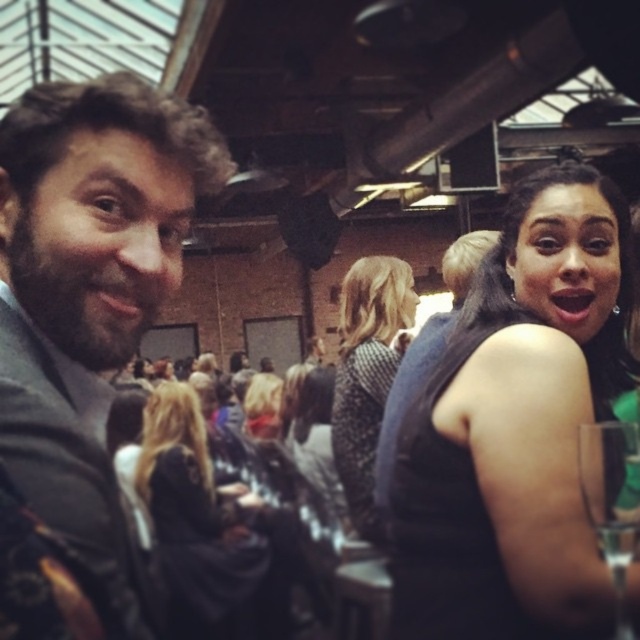
Question: Which of these objects is positioned closest to the dark gray suit at left?

Choices:
 (A) clear glass wine glass at lower right
 (B) black fabric at center
 (C) black matte dress at upper right
 (D) black fabric dress at upper right

Answer: (A)

Question: Which object is positioned closest to the black fabric dress at upper right?

Choices:
 (A) clear glass wine glass at lower right
 (B) black matte dress at upper right
 (C) black fabric at center
 (D) dark gray suit at left

Answer: (B)

Question: Does patterned sweater at center appear under clear glass wine glass at lower right?

Choices:
 (A) no
 (B) yes

Answer: (B)

Question: Does dark gray suit at left appear on the left side of black fabric dress at upper right?

Choices:
 (A) yes
 (B) no

Answer: (A)

Question: Is black matte dress at upper right further to the viewer compared to black fabric at center?

Choices:
 (A) no
 (B) yes

Answer: (A)

Question: Based on their relative distances, which object is farther from the dark gray suit at left?

Choices:
 (A) black fabric dress at upper right
 (B) patterned sweater at center

Answer: (B)